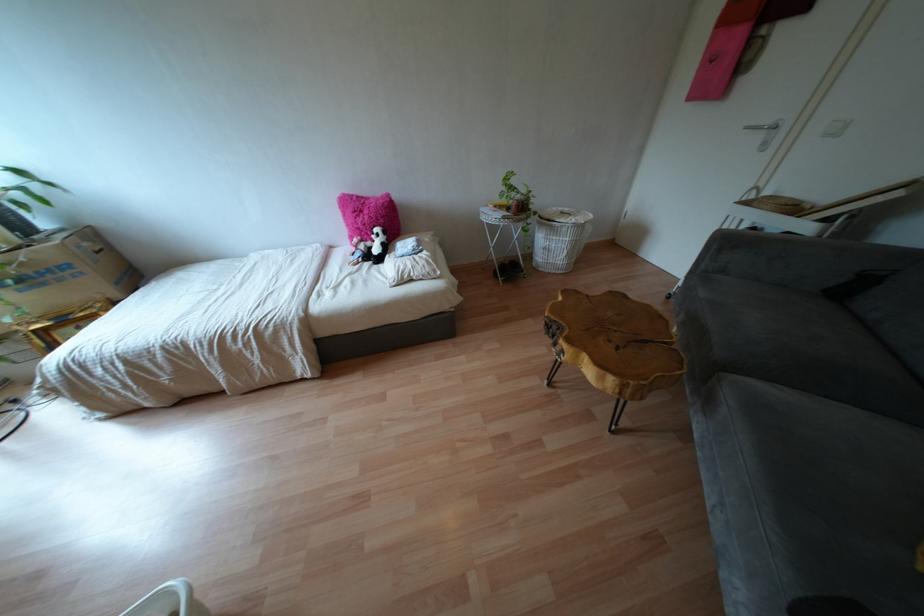
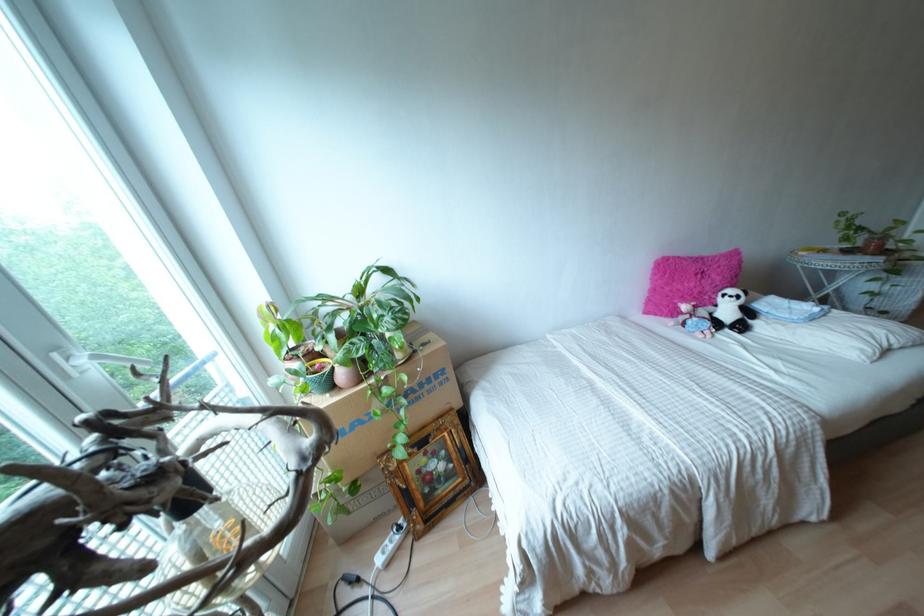
Where in the second image is the point corresponding to pixel 385 248 from the first image?

(747, 312)